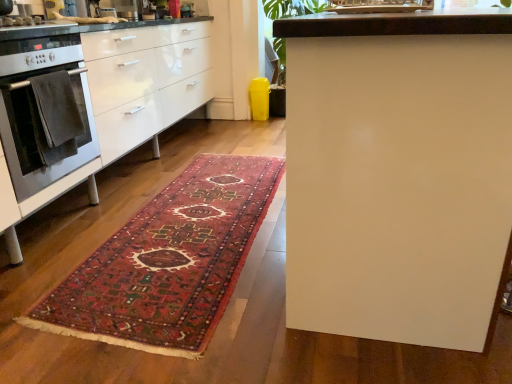
Question: From the image's perspective, relative to stainless steel oven at left, is carpeted rug at center above or below?

Choices:
 (A) below
 (B) above

Answer: (A)

Question: In terms of height, does carpeted rug at center look taller or shorter compared to stainless steel oven at left?

Choices:
 (A) short
 (B) tall

Answer: (A)

Question: Which is farther from the stainless steel oven at left?

Choices:
 (A) white glossy table at center
 (B) carpeted rug at center
 (C) velvety dark gray towel at left

Answer: (A)

Question: Which object is the farthest from the velvety dark gray towel at left?

Choices:
 (A) carpeted rug at center
 (B) stainless steel oven at left
 (C) white glossy table at center

Answer: (C)